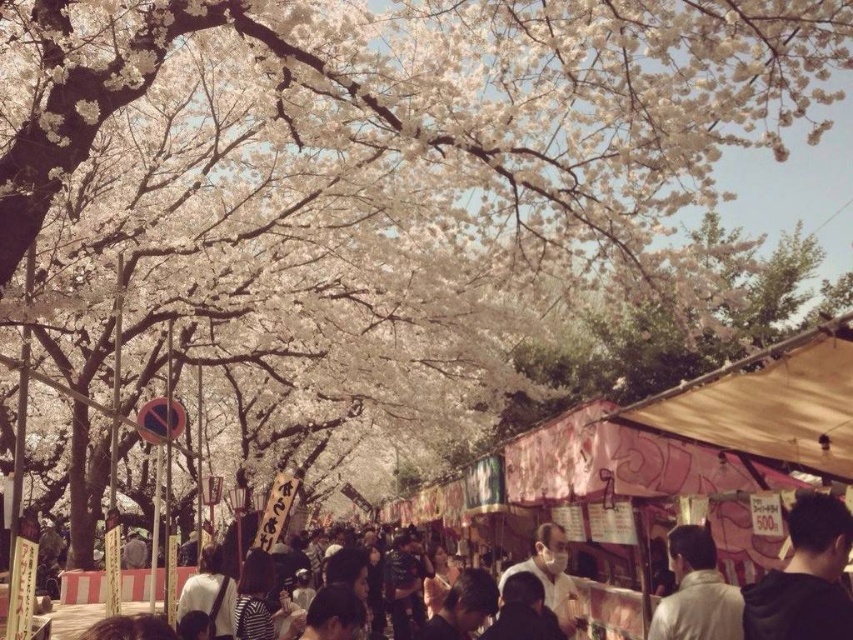
In the scene shown: Which is below, black matte hair at lower right or white matte jacket at center?

white matte jacket at center is below.

Is black matte hair at lower right wider than white matte jacket at center?

In fact, black matte hair at lower right might be narrower than white matte jacket at center.

Is point (820, 520) behind point (712, 580)?

No.

Where is `black matte hair at lower right`? black matte hair at lower right is located at coordinates (805, 577).

Who is positioned more to the left, white matte jacket at center or matte black mask at center?

matte black mask at center is more to the left.

Can you confirm if white matte jacket at center is bigger than matte black mask at center?

No.

Is point (711, 608) in front of point (575, 616)?

Yes, point (711, 608) is in front of point (575, 616).

Find the location of a particular element. This screenshot has width=853, height=640. white matte jacket at center is located at coordinates (695, 593).

Which of these two, black matte hair at lower right or matte black mask at center, stands shorter?

black matte hair at lower right is shorter.

Is black matte hair at lower right to the right of matte black mask at center from the viewer's perspective?

Yes, black matte hair at lower right is to the right of matte black mask at center.

This screenshot has height=640, width=853. What are the coordinates of `black matte hair at lower right` in the screenshot? It's located at (805, 577).